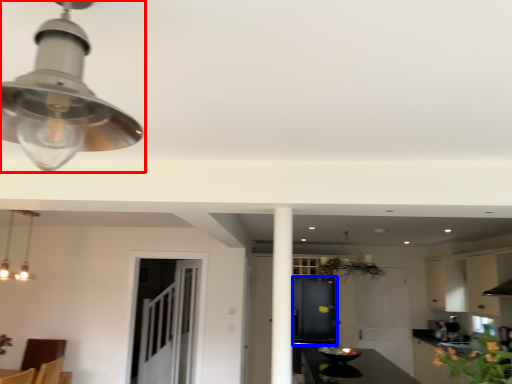
Question: Which point is further to the camera, lamp (highlighted by a red box) or cabinetry (highlighted by a blue box)?

Choices:
 (A) lamp
 (B) cabinetry

Answer: (B)